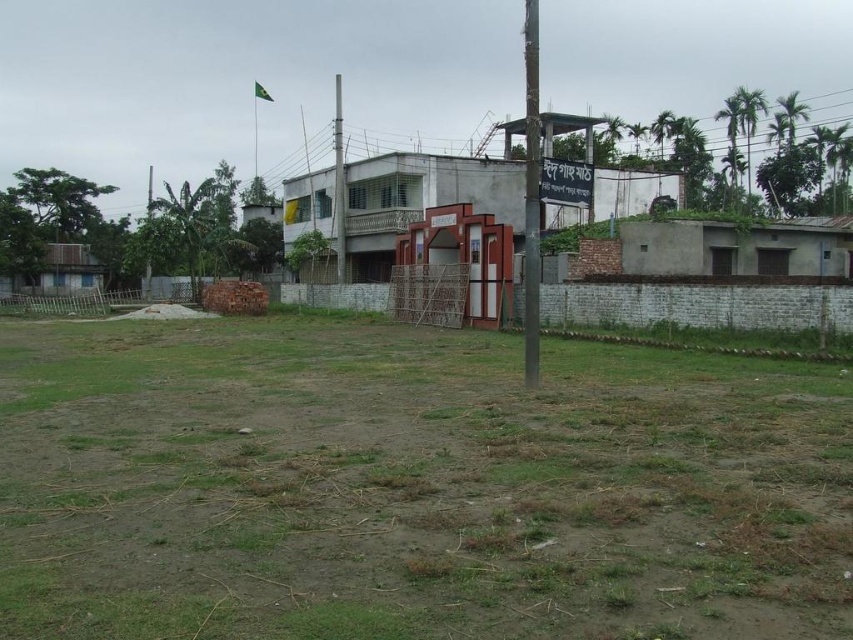
Which is in front, point (527, 224) or point (341, 108)?

Point (527, 224) is in front.

Between metallic pole at center and smooth metallic pole at center, which one is positioned lower?

smooth metallic pole at center

What do you see at coordinates (531, 195) in the screenshot?
I see `metallic pole at center` at bounding box center [531, 195].

Identify the location of metallic pole at center. (531, 195).

Is green grassy field at center below green fabric flag at upper center?

Yes, green grassy field at center is below green fabric flag at upper center.

Which is behind, point (78, 390) or point (265, 99)?

The point (265, 99) is more distant.

Does point (836, 451) lie in front of point (256, 92)?

Yes, it is.

Locate an element on the screen. green grassy field at center is located at coordinates (412, 486).

Who is positioned more to the left, metallic pole at center or green fabric flag at upper center?

green fabric flag at upper center

Between point (538, 241) and point (259, 90), which one is positioned behind?

Positioned behind is point (259, 90).

This screenshot has width=853, height=640. What are the coordinates of `metallic pole at center` in the screenshot? It's located at (531, 195).